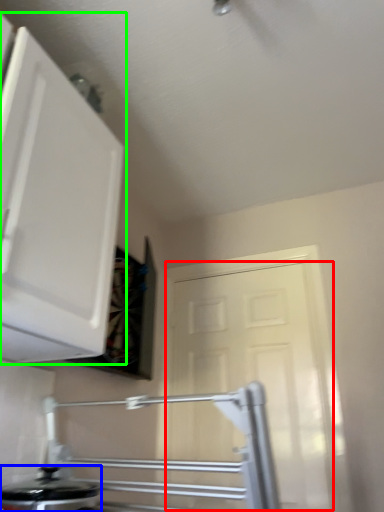
Question: Estimate the real-world distances between objects in this image. Which object is closer to door (highlighted by a red box), kitchen appliance (highlighted by a blue box) or cabinetry (highlighted by a green box)?

Choices:
 (A) kitchen appliance
 (B) cabinetry

Answer: (A)